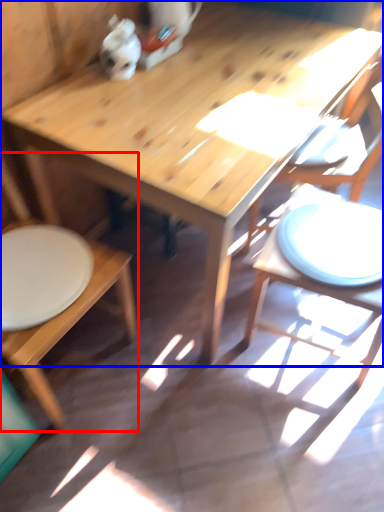
Question: Which object appears closest to the camera in this image, chair (highlighted by a red box) or table (highlighted by a blue box)?

Choices:
 (A) chair
 (B) table

Answer: (A)